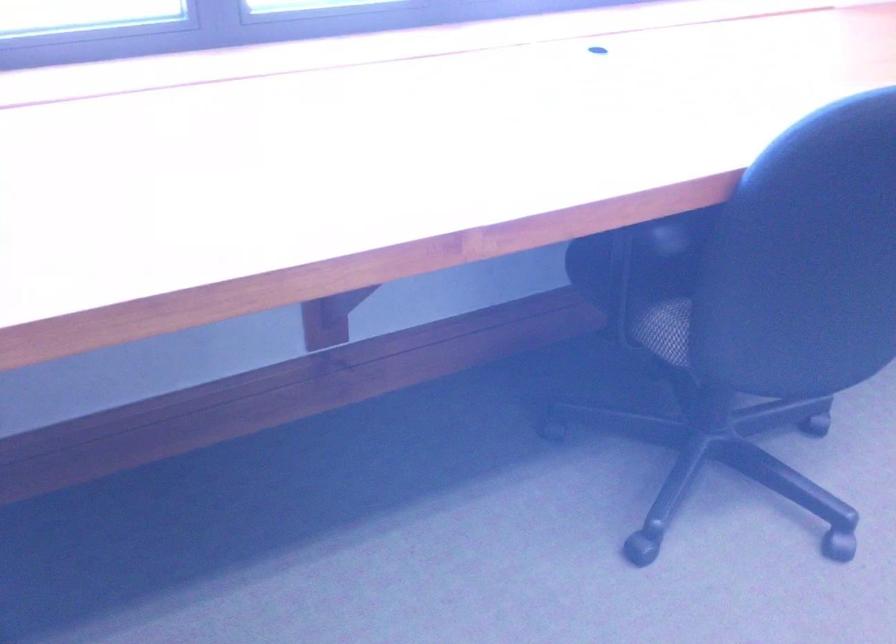
Identify the location of black chair sitting surface. This screenshot has width=896, height=644. (645, 279).